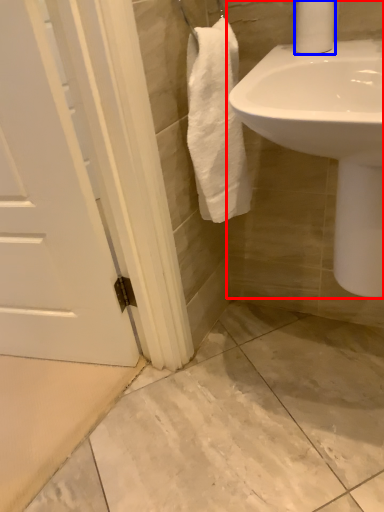
Question: Which of the following is the farthest to the observer, sink (highlighted by a red box) or toilet paper (highlighted by a blue box)?

Choices:
 (A) sink
 (B) toilet paper

Answer: (B)